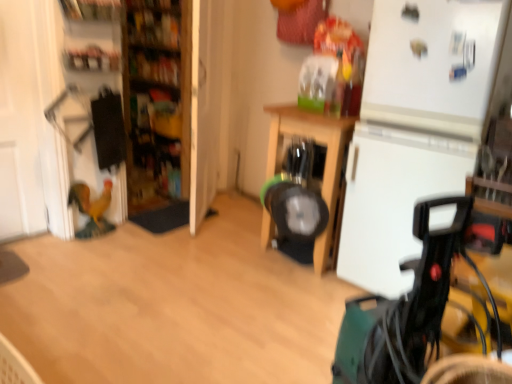
Locate an element on the screen. This screenshot has width=512, height=384. green plastic baby carriage at lower right is located at coordinates (406, 309).

What do you see at coordinates (92, 46) in the screenshot? The height and width of the screenshot is (384, 512). I see `matte plastic shelf at upper left, the 1th shelf from the bottom` at bounding box center [92, 46].

The height and width of the screenshot is (384, 512). Describe the element at coordinates (92, 9) in the screenshot. I see `wooden bookshelf at upper left, marked as the 1th shelf in a top-to-bottom arrangement` at that location.

At what (x,y) coordinates should I click in order to perform the action: click on white matte refrigerator at right. Please return your answer as a coordinate pair (x, y). The width and height of the screenshot is (512, 384). Looking at the image, I should click on (418, 124).

This screenshot has height=384, width=512. Describe the element at coordinates (324, 165) in the screenshot. I see `wooden table at center` at that location.

The width and height of the screenshot is (512, 384). What are the coordinates of `wooden table at center` in the screenshot? It's located at (324, 165).

Locate an element on the screen. The height and width of the screenshot is (384, 512). green plastic baby carriage at lower right is located at coordinates (406, 309).

Is wooden table at center facing towards matte plastic shelf at upper left, arranged as the second shelf when viewed from the top?

No, wooden table at center does not turn towards matte plastic shelf at upper left, arranged as the second shelf when viewed from the top.

Can you confirm if wooden table at center is shorter than matte plastic shelf at upper left, arranged as the second shelf when viewed from the top?

In fact, wooden table at center may be taller than matte plastic shelf at upper left, arranged as the second shelf when viewed from the top.

Does wooden table at center lie behind matte plastic shelf at upper left, arranged as the second shelf when viewed from the top?

No, it is not.

From the image's perspective, relative to matte plastic shelf at upper left, arranged as the second shelf when viewed from the top, is wooden table at center above or below?

wooden table at center is below matte plastic shelf at upper left, arranged as the second shelf when viewed from the top.

Is wooden table at center at the back of wooden bookshelf at upper left, positioned as the 2th shelf in bottom-to-top order?

No, wooden table at center is not at the back of wooden bookshelf at upper left, positioned as the 2th shelf in bottom-to-top order.

Would you say wooden bookshelf at upper left, positioned as the 2th shelf in bottom-to-top order, is outside wooden table at center?

Indeed, wooden bookshelf at upper left, positioned as the 2th shelf in bottom-to-top order, is completely outside wooden table at center.

From the image's perspective, who appears lower, wooden bookshelf at upper left, positioned as the 2th shelf in bottom-to-top order, or wooden table at center?

wooden table at center.

Is matte plastic shelf at upper left, arranged as the second shelf when viewed from the top, turned away from wooden shelves at left?

No, matte plastic shelf at upper left, arranged as the second shelf when viewed from the top, is not facing away from wooden shelves at left.

Which of these two, matte plastic shelf at upper left, the 1th shelf from the bottom, or wooden shelves at left, stands shorter?

Standing shorter between the two is matte plastic shelf at upper left, the 1th shelf from the bottom.

How far apart are matte plastic shelf at upper left, arranged as the second shelf when viewed from the top, and wooden shelves at left?

They are 33.32 inches apart.

From a real-world perspective, is matte plastic shelf at upper left, the 1th shelf from the bottom, positioned above or below wooden shelves at left?

Clearly, from a real-world perspective, matte plastic shelf at upper left, the 1th shelf from the bottom, is above wooden shelves at left.

From the image's perspective, which one is positioned lower, wooden table at center or green plastic baby carriage at lower right?

green plastic baby carriage at lower right.

How distant is wooden table at center from green plastic baby carriage at lower right?

The distance of wooden table at center from green plastic baby carriage at lower right is 36.47 inches.

Where is `furniture that appears above the green plastic baby carriage at lower right (from a real-world perspective)`? furniture that appears above the green plastic baby carriage at lower right (from a real-world perspective) is located at coordinates (324, 165).

From a real-world perspective, is wooden table at center located beneath green plastic baby carriage at lower right?

No.

Is green plastic baby carriage at lower right in contact with matte plastic shelf at upper left, the 1th shelf from the bottom?

There is a gap between green plastic baby carriage at lower right and matte plastic shelf at upper left, the 1th shelf from the bottom.

Based on their sizes in the image, would you say green plastic baby carriage at lower right is bigger or smaller than matte plastic shelf at upper left, the 1th shelf from the bottom?

Considering their sizes, green plastic baby carriage at lower right takes up more space than matte plastic shelf at upper left, the 1th shelf from the bottom.

Is green plastic baby carriage at lower right taller or shorter than matte plastic shelf at upper left, arranged as the second shelf when viewed from the top?

green plastic baby carriage at lower right is taller than matte plastic shelf at upper left, arranged as the second shelf when viewed from the top.

Is green plastic baby carriage at lower right facing towards matte plastic shelf at upper left, arranged as the second shelf when viewed from the top?

No, green plastic baby carriage at lower right does not turn towards matte plastic shelf at upper left, arranged as the second shelf when viewed from the top.

The image size is (512, 384). Find the location of `furniture that is below the wooden shelves at left (from the image's perspective)`. furniture that is below the wooden shelves at left (from the image's perspective) is located at coordinates pos(324,165).

From a real-world perspective, is wooden table at center below wooden shelves at left?

Yes, from a real-world perspective, wooden table at center is beneath wooden shelves at left.

Is wooden shelves at left surrounded by wooden table at center?

No, wooden shelves at left is not surrounded by wooden table at center.

Would you say green plastic baby carriage at lower right is part of wooden shelves at left's contents?

That's incorrect, green plastic baby carriage at lower right is not inside wooden shelves at left.

Considering the sizes of objects wooden shelves at left and green plastic baby carriage at lower right in the image provided, who is smaller, wooden shelves at left or green plastic baby carriage at lower right?

Smaller between the two is green plastic baby carriage at lower right.

From a real-world perspective, which is physically below, wooden shelves at left or green plastic baby carriage at lower right?

green plastic baby carriage at lower right, from a real-world perspective.

In the scene shown: Visually, is wooden shelves at left positioned to the left or to the right of green plastic baby carriage at lower right?

In the image, wooden shelves at left appears on the left side of green plastic baby carriage at lower right.

What are the coordinates of `the 1st shelf above the wooden table at center (from the image's perspective)` in the screenshot? It's located at (92, 46).

At what (x,y) coordinates should I click in order to perform the action: click on furniture lying below the wooden bookshelf at upper left, marked as the 1th shelf in a top-to-bottom arrangement (from the image's perspective). Please return your answer as a coordinate pair (x, y). Looking at the image, I should click on (324, 165).

Considering their positions, is wooden table at center positioned closer to wooden shelves at left than wooden bookshelf at upper left, positioned as the 2th shelf in bottom-to-top order?

Among the two, wooden bookshelf at upper left, positioned as the 2th shelf in bottom-to-top order, is located nearer to wooden shelves at left.

Which object lies nearer to the anchor point wooden bookshelf at upper left, positioned as the 2th shelf in bottom-to-top order, green plastic baby carriage at lower right or matte plastic shelf at upper left, arranged as the second shelf when viewed from the top?

Among the two, matte plastic shelf at upper left, arranged as the second shelf when viewed from the top, is located nearer to wooden bookshelf at upper left, positioned as the 2th shelf in bottom-to-top order.

Looking at the image, which one is located further to white matte refrigerator at right, wooden table at center or wooden bookshelf at upper left, positioned as the 2th shelf in bottom-to-top order?

Among the two, wooden bookshelf at upper left, positioned as the 2th shelf in bottom-to-top order, is located further to white matte refrigerator at right.

From the picture: Based on their spatial positions, is white matte refrigerator at right or matte plastic shelf at upper left, the 1th shelf from the bottom, closer to green plastic baby carriage at lower right?

white matte refrigerator at right is closer to green plastic baby carriage at lower right.

From the image, which object appears to be farther from wooden bookshelf at upper left, positioned as the 2th shelf in bottom-to-top order, white matte refrigerator at right or green plastic baby carriage at lower right?

Among the two, green plastic baby carriage at lower right is located further to wooden bookshelf at upper left, positioned as the 2th shelf in bottom-to-top order.

Considering their positions, is white matte refrigerator at right positioned further to wooden shelves at left than wooden table at center?

white matte refrigerator at right is further to wooden shelves at left.

From the image, which object appears to be farther from wooden bookshelf at upper left, positioned as the 2th shelf in bottom-to-top order, wooden shelves at left or matte plastic shelf at upper left, arranged as the second shelf when viewed from the top?

wooden shelves at left lies further to wooden bookshelf at upper left, positioned as the 2th shelf in bottom-to-top order, than the other object.

Considering their positions, is white matte refrigerator at right positioned further to wooden shelves at left than wooden bookshelf at upper left, positioned as the 2th shelf in bottom-to-top order?

white matte refrigerator at right is further to wooden shelves at left.

The width and height of the screenshot is (512, 384). I want to click on shelf situated between matte plastic shelf at upper left, the 1th shelf from the bottom, and green plastic baby carriage at lower right from left to right, so (92, 9).

Where is `furniture situated between wooden bookshelf at upper left, marked as the 1th shelf in a top-to-bottom arrangement, and green plastic baby carriage at lower right from left to right`? This screenshot has height=384, width=512. furniture situated between wooden bookshelf at upper left, marked as the 1th shelf in a top-to-bottom arrangement, and green plastic baby carriage at lower right from left to right is located at coordinates (324, 165).

Image resolution: width=512 pixels, height=384 pixels. Identify the location of bookshelf situated between matte plastic shelf at upper left, arranged as the second shelf when viewed from the top, and wooden table at center from left to right. (159, 112).

The height and width of the screenshot is (384, 512). I want to click on furniture between wooden bookshelf at upper left, positioned as the 2th shelf in bottom-to-top order, and white matte refrigerator at right, in the horizontal direction, so click(x=324, y=165).